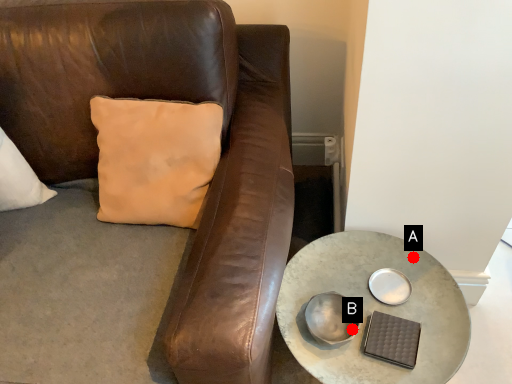
Question: Two points are circled on the image, labeled by A and B beside each circle. Which point appears farthest from the camera in this image?

Choices:
 (A) A is further
 (B) B is further

Answer: (A)